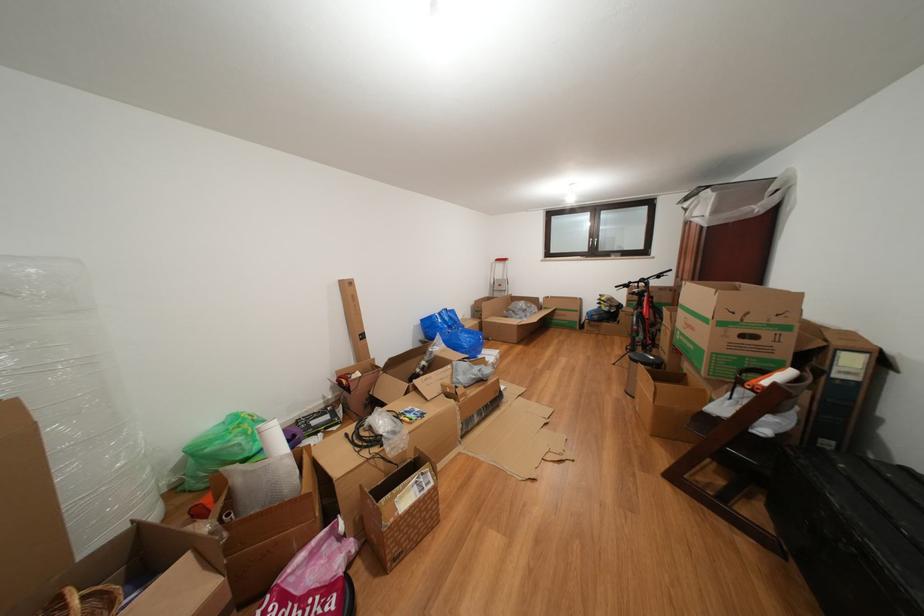
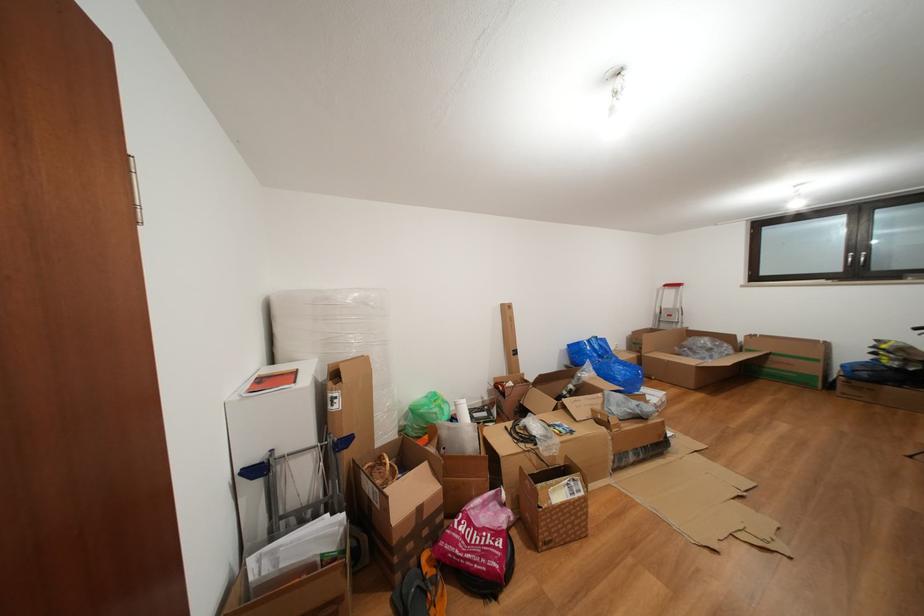
In the second image, find the point that corresponds to [220,447] in the first image.

(431, 411)